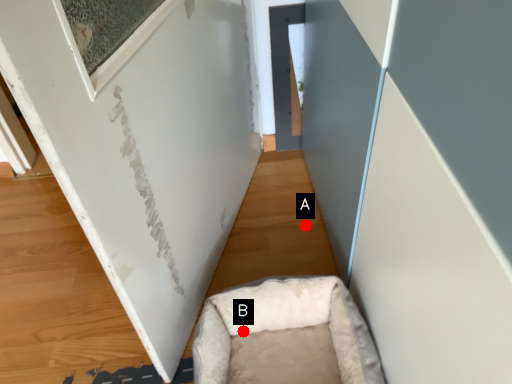
Question: Two points are circled on the image, labeled by A and B beside each circle. Among these points, which one is farthest from the camera?

Choices:
 (A) A is further
 (B) B is further

Answer: (A)